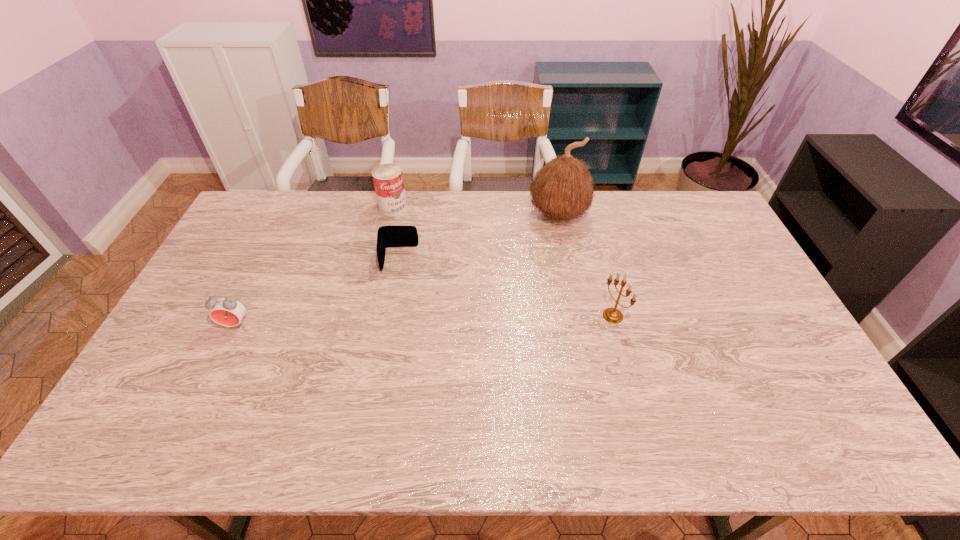
Image resolution: width=960 pixels, height=540 pixels. I want to click on object positioned at the left edge, so click(226, 311).

This screenshot has height=540, width=960. Identify the location of free space at the far edge of the desktop. (299, 202).

Where is `vacant area at the near edge of the desktop`? vacant area at the near edge of the desktop is located at coordinates (438, 404).

This screenshot has width=960, height=540. I want to click on vacant space at the left edge of the desktop, so click(265, 252).

Identify the location of blank space at the right edge of the desktop. click(x=744, y=294).

Locate an element on the screen. The image size is (960, 540). blank space at the near left corner is located at coordinates (174, 388).

You are a GUI agent. You are given a task and a screenshot of the screen. Output one action in this format:
    pyautogui.click(x=<x>, y=<y>)
    Task: Click on the free space at the far right corner
    The width and height of the screenshot is (960, 540).
    Given the screenshot: What is the action you would take?
    pyautogui.click(x=700, y=219)

Locate an element on the screen. This screenshot has height=540, width=960. blank region between the third shortest object and the fourth tallest object is located at coordinates (314, 266).

In order to click on vacant space that's between the alarm clock and the third tallest object in this screenshot , I will do `click(314, 266)`.

Find the location of a particular element. free space between the leftmost object and the candelabrum is located at coordinates (424, 320).